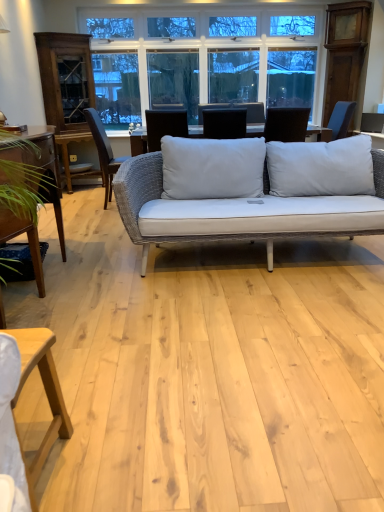
You are a GUI agent. You are given a task and a screenshot of the screen. Output one action in this format:
    pyautogui.click(x=<x>, y=<y>)
    Task: Click on the vacant area that is situated to the right of light wood table at lower left, acting as the second table starting from the left
    This screenshot has height=512, width=384.
    Given the screenshot: What is the action you would take?
    pyautogui.click(x=103, y=467)